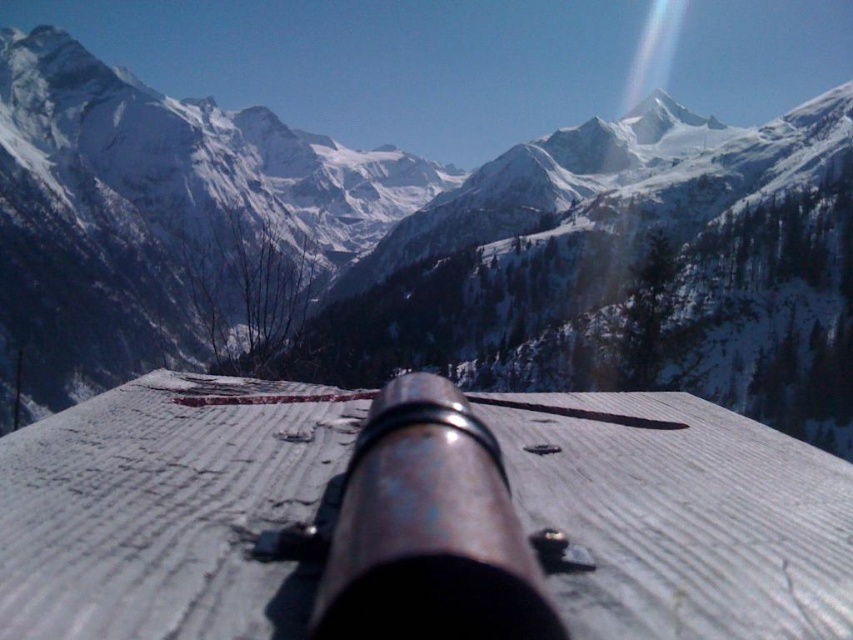
Question: Does snowy rocky mountain range at upper center lie behind rusty metal cannon at center?

Choices:
 (A) no
 (B) yes

Answer: (B)

Question: Among these points, which one is nearest to the camera?

Choices:
 (A) (473, 556)
 (B) (352, 380)

Answer: (A)

Question: Does snowy rocky mountain range at upper center lie behind rusty metal cannon at center?

Choices:
 (A) yes
 (B) no

Answer: (A)

Question: Which object is closer to the camera taking this photo?

Choices:
 (A) snowy rocky mountain range at upper center
 (B) rusty metal cannon at center

Answer: (B)

Question: Which point appears farthest from the camera in this image?

Choices:
 (A) (482, 595)
 (B) (430, 264)

Answer: (B)

Question: Observing the image, what is the correct spatial positioning of snowy rocky mountain range at upper center in reference to rusty metal cannon at center?

Choices:
 (A) below
 (B) above

Answer: (B)